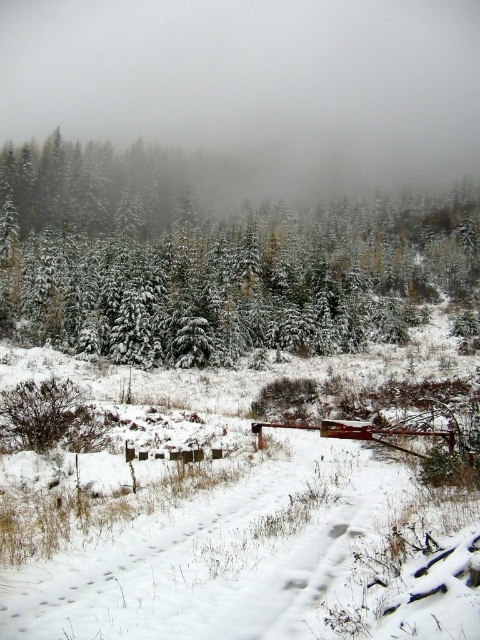
You are standing at the red metal gate and want to walk towards the fence. Which point, point [216,115] or point [104,349], is closer to you as you start walking?

Point [216,115] is closer to you because it is further to the viewer than point [104,349], meaning it is nearer in the scene.

Consider the image. You are standing at the entrance of the forest and see the point marked at coordinates (254, 90). Based on the scene description, what object or feature is located at this point?

The point at coordinates (254, 90) corresponds to a white foggy cloud at upper center in the scene.